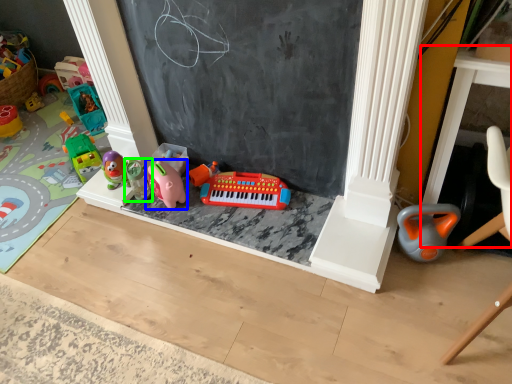
Question: Estimate the real-world distances between objects in this image. Which object is farther from table (highlighted by a red box), toy (highlighted by a blue box) or toy (highlighted by a green box)?

Choices:
 (A) toy
 (B) toy

Answer: (B)